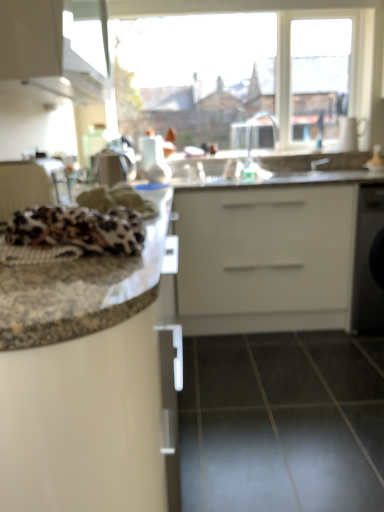
Question: Considering the relative sizes of silver metallic faucet at upper center and granite countertop at center in the image provided, is silver metallic faucet at upper center shorter than granite countertop at center?

Choices:
 (A) no
 (B) yes

Answer: (B)

Question: Is silver metallic faucet at upper center oriented towards granite countertop at center?

Choices:
 (A) no
 (B) yes

Answer: (A)

Question: Would you consider silver metallic faucet at upper center to be distant from granite countertop at center?

Choices:
 (A) yes
 (B) no

Answer: (B)

Question: From the image's perspective, is silver metallic faucet at upper center located above granite countertop at center?

Choices:
 (A) yes
 (B) no

Answer: (A)

Question: From a real-world perspective, is silver metallic faucet at upper center physically below granite countertop at center?

Choices:
 (A) yes
 (B) no

Answer: (B)

Question: Does silver metallic faucet at upper center have a greater height compared to granite countertop at center?

Choices:
 (A) yes
 (B) no

Answer: (B)

Question: Is white glossy cabinet at upper left positioned beyond the bounds of leopard print fabric at left?

Choices:
 (A) no
 (B) yes

Answer: (B)

Question: Is white glossy cabinet at upper left positioned before leopard print fabric at left?

Choices:
 (A) no
 (B) yes

Answer: (A)

Question: Does white glossy cabinet at upper left come behind leopard print fabric at left?

Choices:
 (A) no
 (B) yes

Answer: (B)

Question: From a real-world perspective, is white glossy cabinet at upper left located beneath leopard print fabric at left?

Choices:
 (A) yes
 (B) no

Answer: (B)

Question: Is white glossy cabinet at upper left at the right side of leopard print fabric at left?

Choices:
 (A) yes
 (B) no

Answer: (B)

Question: Can you confirm if white glossy cabinet at upper left is wider than leopard print fabric at left?

Choices:
 (A) yes
 (B) no

Answer: (B)

Question: Is white glossy cabinet at upper left beside silver metallic faucet at upper center?

Choices:
 (A) yes
 (B) no

Answer: (B)